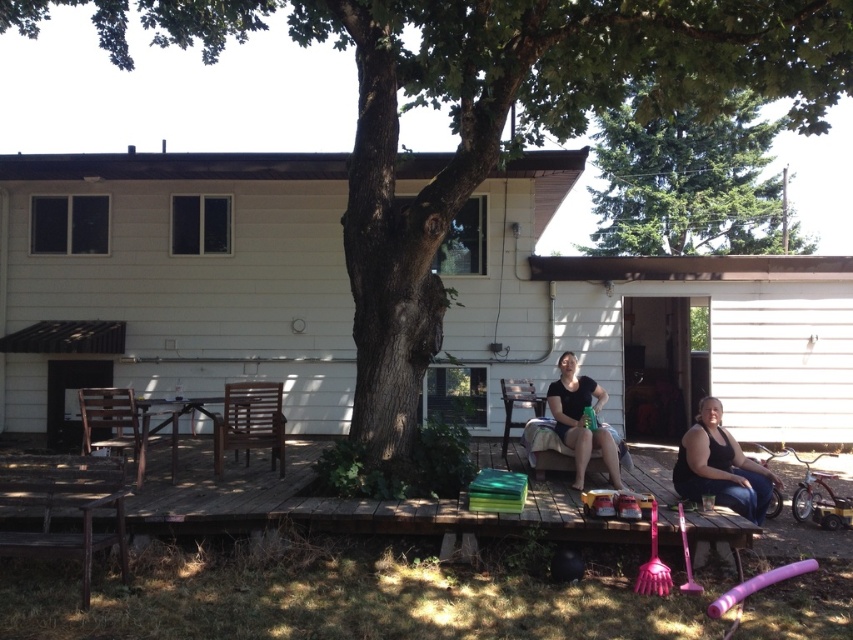
Is matte black shorts at center positioned behind black fabric woman at lower right?

Yes, matte black shorts at center is behind black fabric woman at lower right.

Does matte black shorts at center have a greater height compared to black fabric woman at lower right?

Incorrect, matte black shorts at center's height is not larger of black fabric woman at lower right's.

This screenshot has height=640, width=853. What do you see at coordinates (720, 467) in the screenshot? I see `matte black shorts at center` at bounding box center [720, 467].

Locate an element on the screen. Image resolution: width=853 pixels, height=640 pixels. matte black shorts at center is located at coordinates (720, 467).

Between green leafy tree at upper center and black fabric woman at lower right, which one has less height?

black fabric woman at lower right is shorter.

Can you confirm if green leafy tree at upper center is taller than black fabric woman at lower right?

Yes.

Image resolution: width=853 pixels, height=640 pixels. Identify the location of green leafy tree at upper center. (689, 182).

Can you confirm if green leafy tree at upper center is positioned to the left of matte black shirt at center?

No, green leafy tree at upper center is not to the left of matte black shirt at center.

Between green leafy tree at upper center and matte black shirt at center, which one has more height?

Standing taller between the two is green leafy tree at upper center.

Is point (733, 120) more distant than point (590, 406)?

That is True.

This screenshot has width=853, height=640. Identify the location of green leafy tree at upper center. (689, 182).